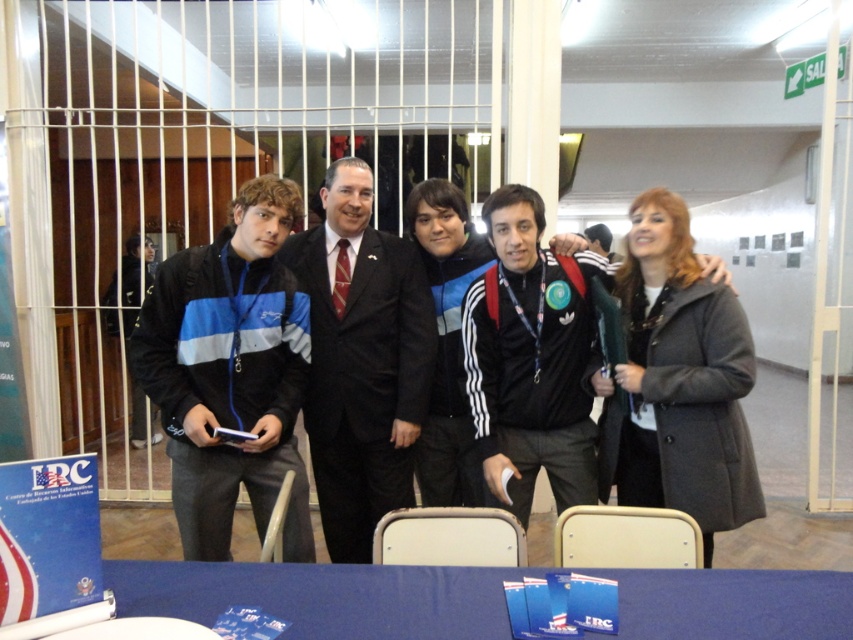
Does black fleece jacket at center appear under black adidas jacket at center?

Indeed, black fleece jacket at center is positioned under black adidas jacket at center.

This screenshot has width=853, height=640. In order to click on black fleece jacket at center in this screenshot , I will do `click(230, 372)`.

Is point (219, 404) farther from viewer compared to point (573, 374)?

No.

Identify the location of black fleece jacket at center. coord(230,372).

Who is higher up, black fleece jacket at center or black suit at center?

black fleece jacket at center is above.

Is point (202, 432) closer to camera compared to point (346, 424)?

Yes, it is in front of point (346, 424).

The width and height of the screenshot is (853, 640). I want to click on black fleece jacket at center, so click(x=230, y=372).

Who is more forward, (199, 364) or (683, 582)?

Point (683, 582) is in front.

Is black fleece jacket at center further to the viewer compared to blue fabric table at lower center?

Yes, black fleece jacket at center is behind blue fabric table at lower center.

Image resolution: width=853 pixels, height=640 pixels. What do you see at coordinates (230, 372) in the screenshot?
I see `black fleece jacket at center` at bounding box center [230, 372].

Where is `black fleece jacket at center`? The height and width of the screenshot is (640, 853). black fleece jacket at center is located at coordinates (230, 372).